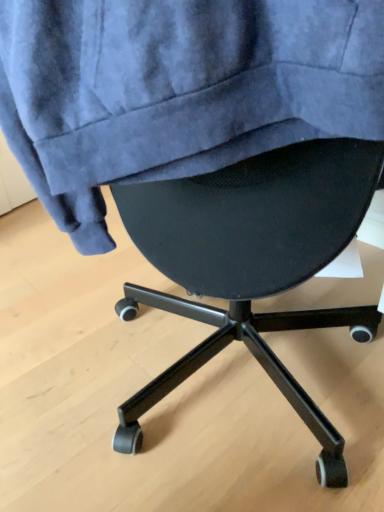
Question: Relative to velvet blue sweatshirt at upper center, is black mesh chair at center in front or behind?

Choices:
 (A) front
 (B) behind

Answer: (B)

Question: Considering the positions of point (342, 442) and point (94, 212), is point (342, 442) closer or farther from the camera than point (94, 212)?

Choices:
 (A) closer
 (B) farther

Answer: (B)

Question: From their relative heights in the image, would you say black mesh chair at center is taller or shorter than velvet blue sweatshirt at upper center?

Choices:
 (A) short
 (B) tall

Answer: (A)

Question: Considering the positions of velvet blue sweatshirt at upper center and black mesh chair at center in the image, is velvet blue sweatshirt at upper center taller or shorter than black mesh chair at center?

Choices:
 (A) tall
 (B) short

Answer: (A)

Question: Is velvet blue sweatshirt at upper center inside the boundaries of black mesh chair at center, or outside?

Choices:
 (A) outside
 (B) inside

Answer: (A)

Question: From a real-world perspective, relative to black mesh chair at center, is velvet blue sweatshirt at upper center vertically above or below?

Choices:
 (A) above
 (B) below

Answer: (A)

Question: Is velvet blue sweatshirt at upper center in front of or behind black mesh chair at center in the image?

Choices:
 (A) front
 (B) behind

Answer: (A)